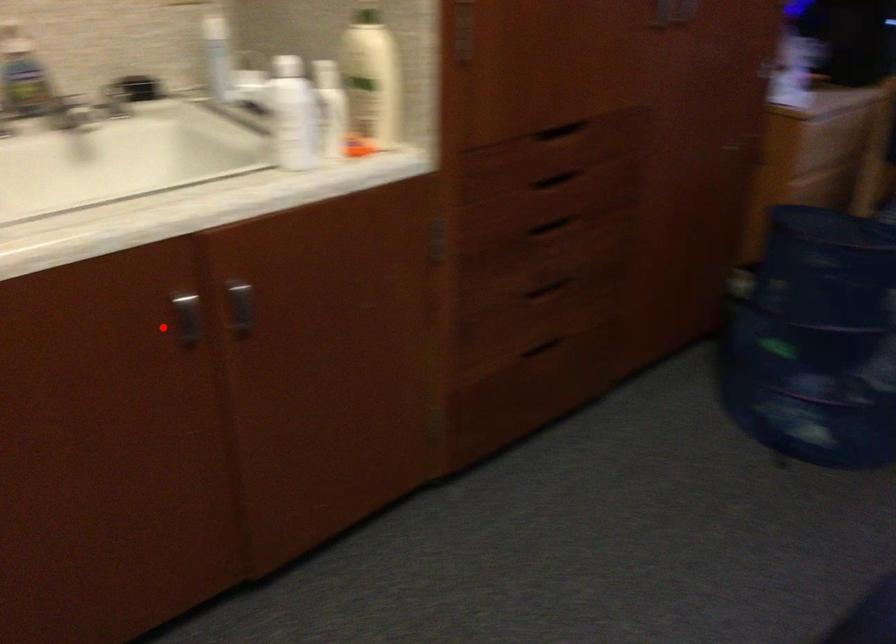
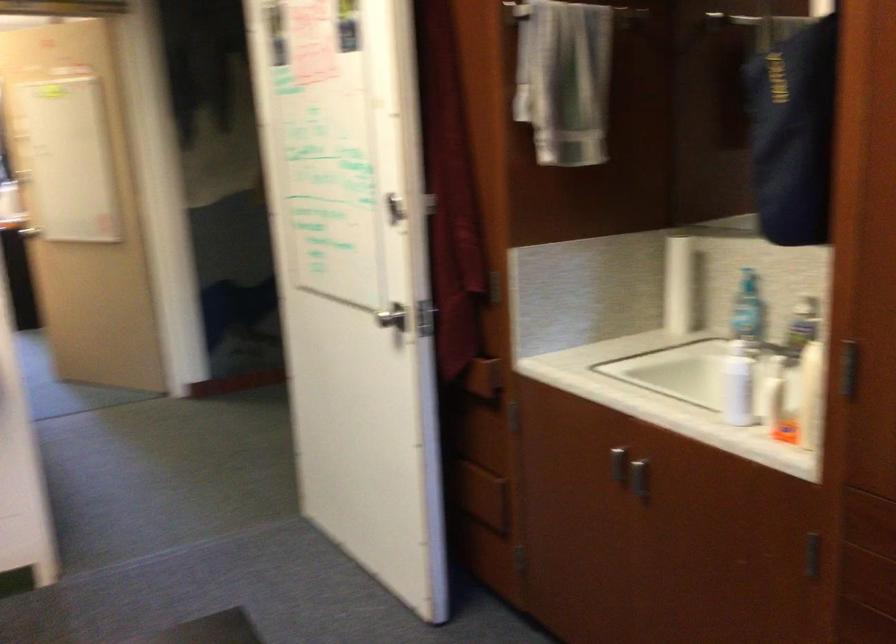
Question: I am providing you with two images of the same scene from different viewpoints. Image1 has a red point marked. In image2, the corresponding 3D location appears at what relative position? Reply with the corresponding letter.

Choices:
 (A) Closer
 (B) Farther

Answer: (B)